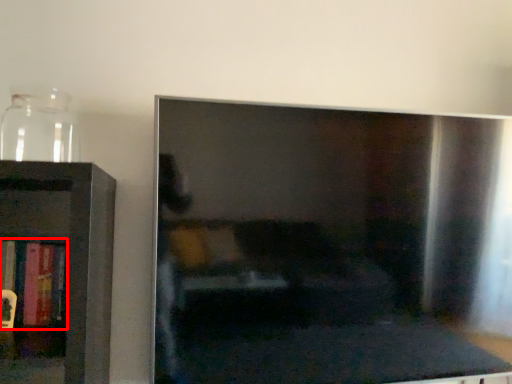
Question: Observing the image, what is the correct spatial positioning of book (annotated by the red box) in reference to glass vase?

Choices:
 (A) right
 (B) left

Answer: (B)